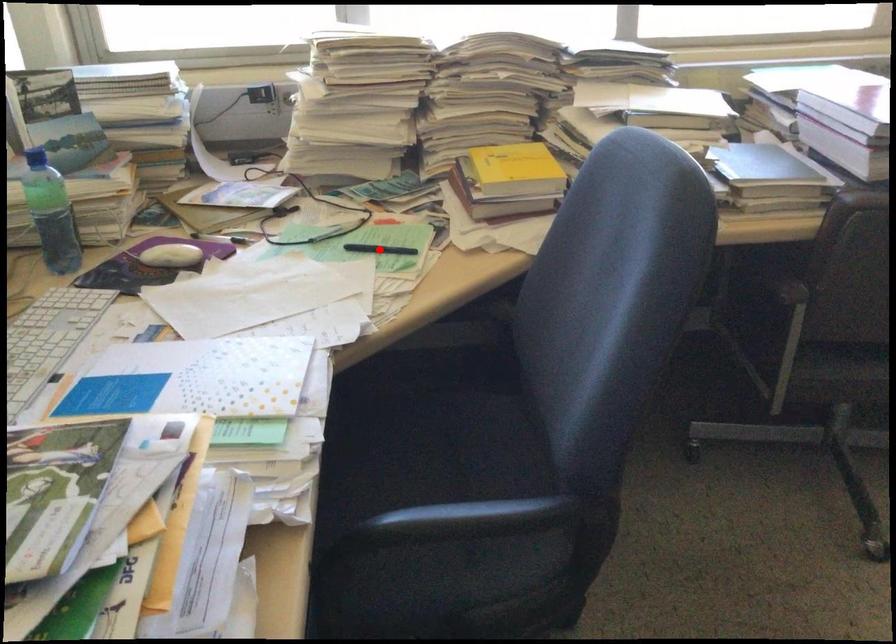
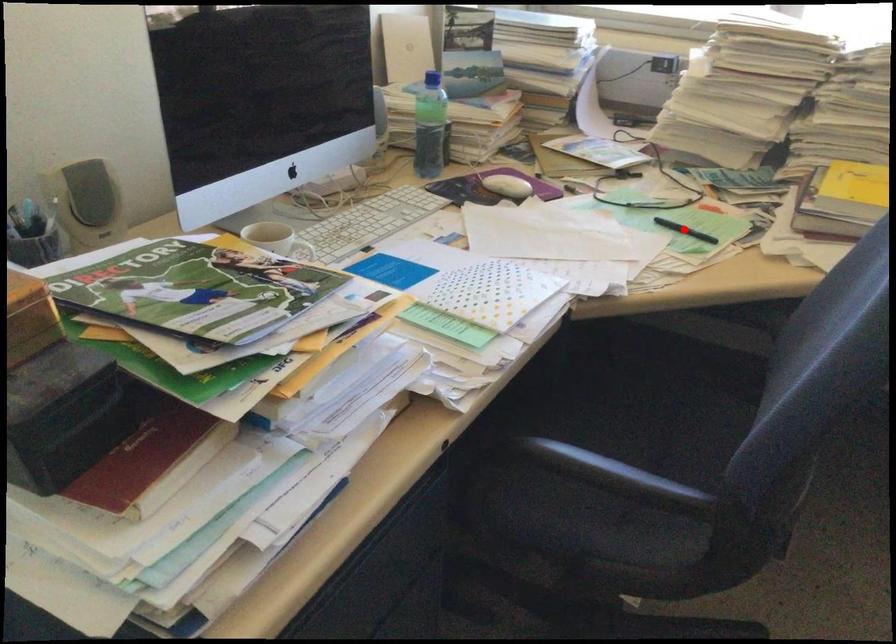
I am providing you with two images of the same scene from different viewpoints. A red point is marked on the first image and another point is marked on the second image. Does the point marked in image1 correspond to the same location as the one in image2?

Yes